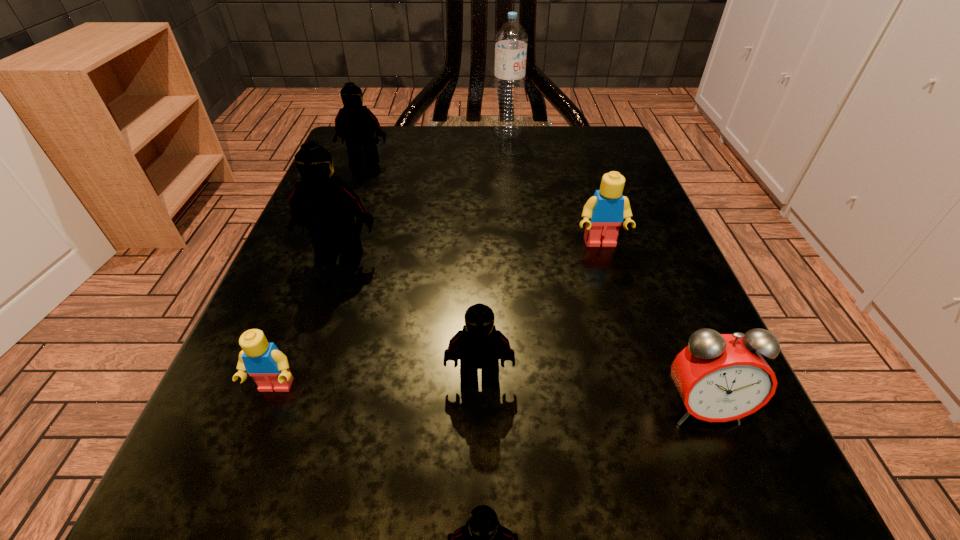
You are a GUI agent. You are given a task and a screenshot of the screen. Output one action in this format:
    pyautogui.click(x=<x>, y=<y>)
    Task: Click on the Lego positioned at the right edge
    The width and height of the screenshot is (960, 540).
    Given the screenshot: What is the action you would take?
    pyautogui.click(x=604, y=212)

Where is `alarm clock that is at the right edge`? alarm clock that is at the right edge is located at coordinates (720, 377).

Find the location of a particular element. object that is at the far left corner is located at coordinates (356, 124).

At what (x,y) coordinates should I click in order to perform the action: click on vacant space at the far edge. Please return your answer as a coordinate pair (x, y). This screenshot has height=540, width=960. Looking at the image, I should click on (427, 165).

Find the location of a particular element. This screenshot has width=960, height=540. blank space at the left edge of the desktop is located at coordinates (375, 248).

Image resolution: width=960 pixels, height=540 pixels. In the image, there is a desktop. What are the coordinates of `vacant space at the right edge` in the screenshot? It's located at (648, 345).

This screenshot has width=960, height=540. What are the coordinates of `vacant space at the far left corner` in the screenshot? It's located at (403, 143).

Where is `free space at the near left corner of the desktop`? free space at the near left corner of the desktop is located at coordinates (159, 515).

The image size is (960, 540). In the image, there is a desktop. Find the location of `free space at the far right corner`. free space at the far right corner is located at coordinates (603, 125).

The height and width of the screenshot is (540, 960). I want to click on empty space between the third tallest object and the nearer yellow Lego, so click(320, 275).